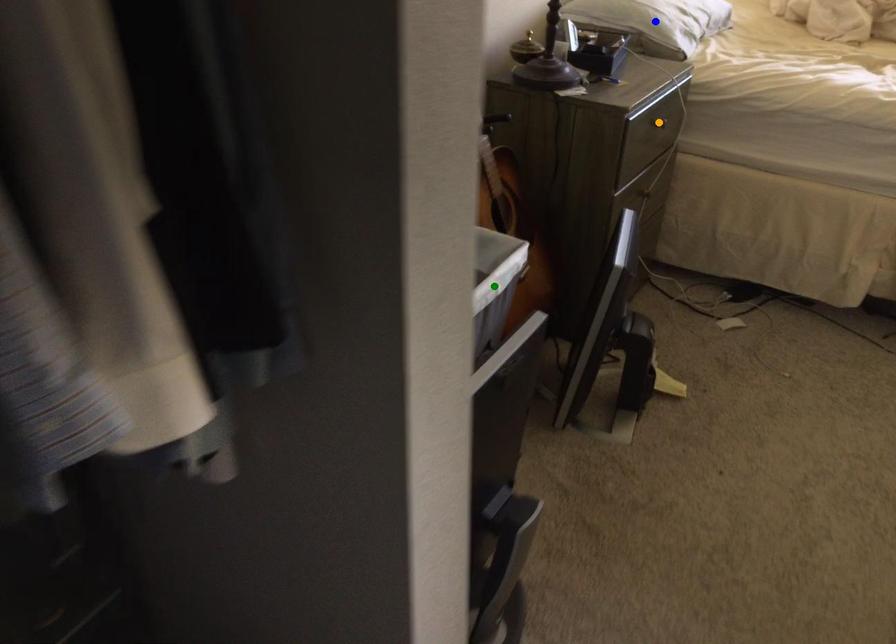
Order these from nearest to farthest:
A) blue point
B) orange point
C) green point

green point, orange point, blue point